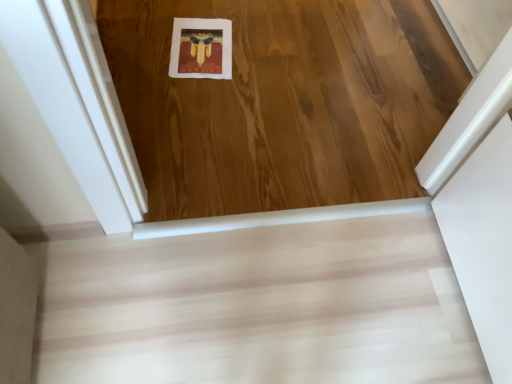
What are the coordinates of `free spot above light wood stairwell at lower center (from a real-world perspective)` in the screenshot? It's located at (236, 304).